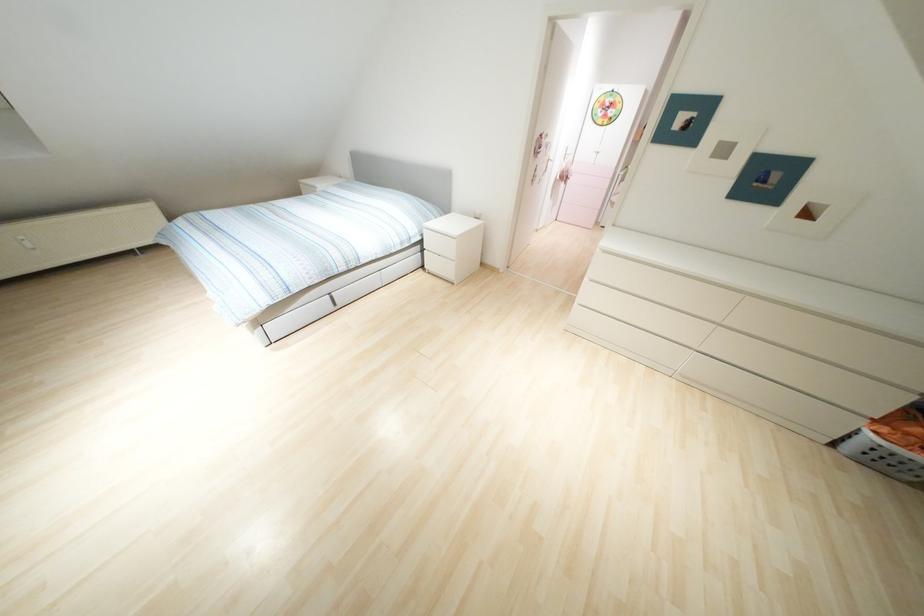
You are a GUI agent. You are given a task and a screenshot of the screen. Output one action in this format:
    pyautogui.click(x=<x>, y=<y>)
    Task: Click on the laundry basket
    The width and height of the screenshot is (924, 616).
    Given the screenshot: What is the action you would take?
    pyautogui.click(x=890, y=444)